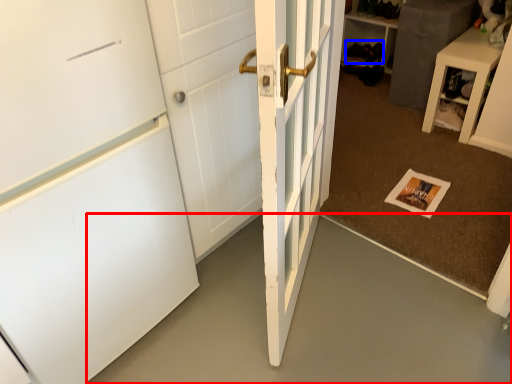
Question: Among these objects, which one is nearest to the camera, concrete (highlighted by a red box) or shoe (highlighted by a blue box)?

Choices:
 (A) concrete
 (B) shoe

Answer: (A)